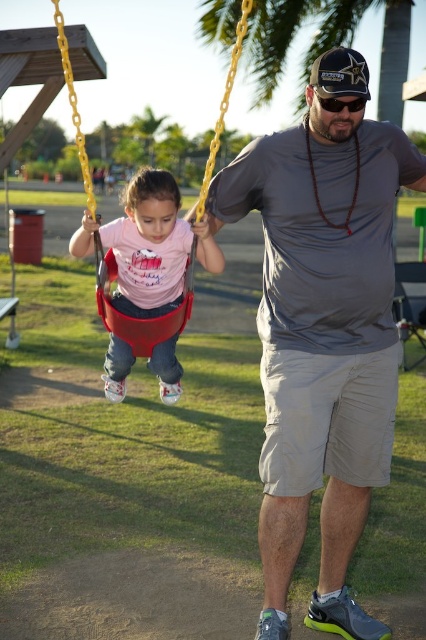
Question: Is gray fabric shirt at center to the left of black plastic goggles at upper center from the viewer's perspective?

Choices:
 (A) yes
 (B) no

Answer: (A)

Question: Which object appears farthest from the camera in this image?

Choices:
 (A) matte plastic swing at left
 (B) black plastic goggles at upper center
 (C) red plastic swing at left

Answer: (A)

Question: Is gray fabric shirt at center bigger than black plastic goggles at upper center?

Choices:
 (A) yes
 (B) no

Answer: (A)

Question: Does gray fabric shirt at center lie behind red plastic swing at left?

Choices:
 (A) no
 (B) yes

Answer: (B)

Question: Based on their relative distances, which object is farther from the red plastic swing at left?

Choices:
 (A) matte plastic swing at left
 (B) black plastic goggles at upper center
 (C) gray fabric shirt at center

Answer: (B)

Question: Which object is farther from the camera taking this photo?

Choices:
 (A) matte plastic swing at left
 (B) black plastic goggles at upper center

Answer: (A)